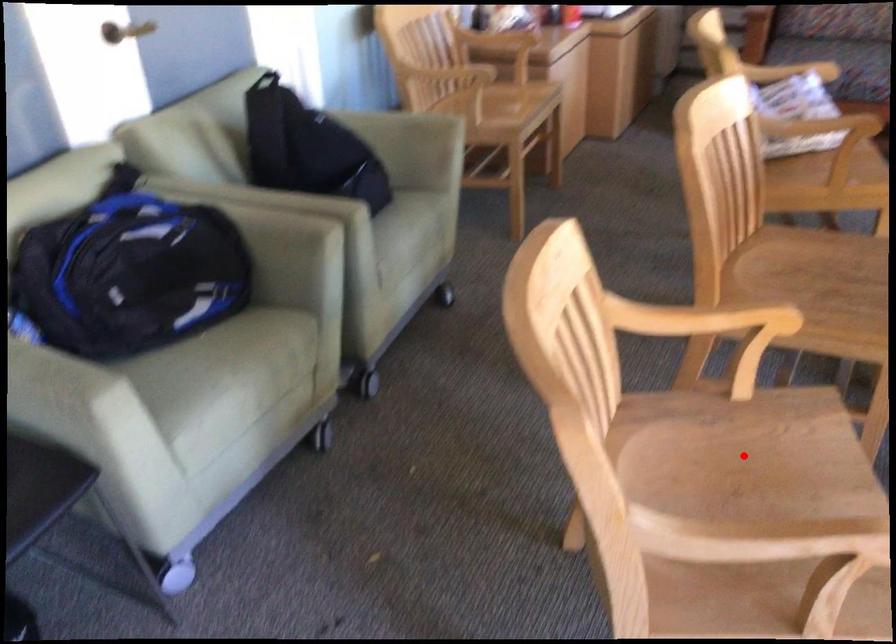
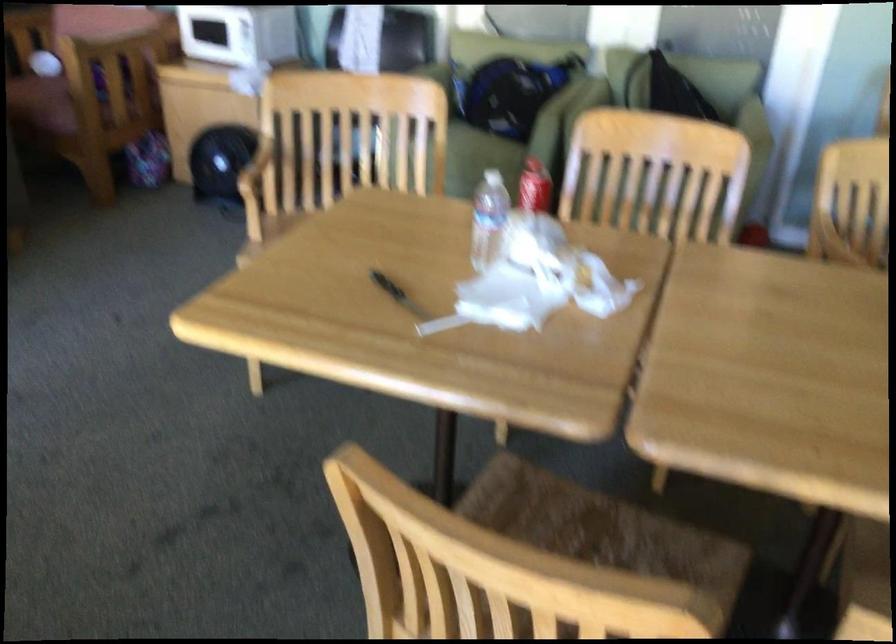
Question: I am providing you with two images of the same scene from different viewpoints. A red point is marked on the first image. Can you still see the location of the red point in image 2?

Choices:
 (A) Yes
 (B) No

Answer: (B)